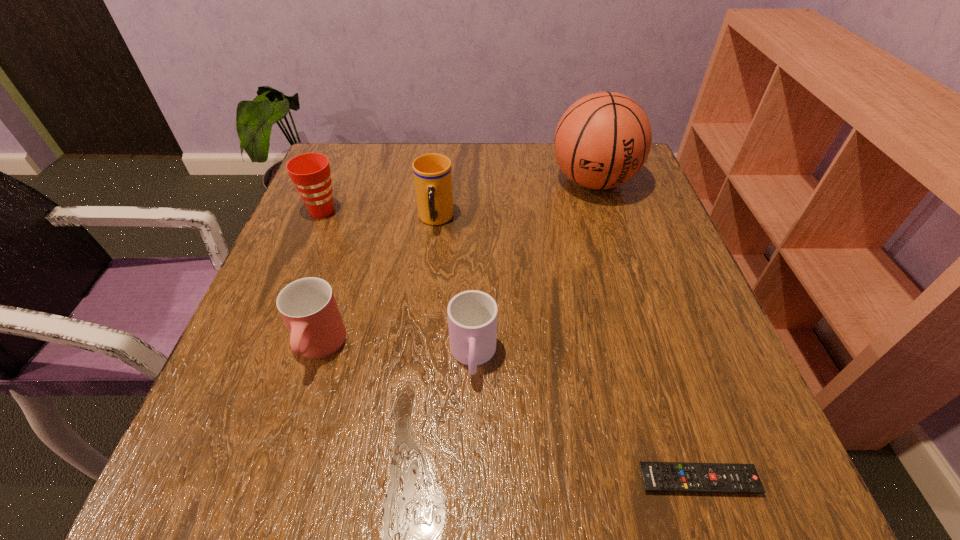
Locate an element on the screen. This screenshot has height=540, width=960. free spot between the third cup from left to right and the leftmost cup is located at coordinates (379, 215).

You are a GUI agent. You are given a task and a screenshot of the screen. Output one action in this format:
    pyautogui.click(x=<x>, y=<y>)
    Task: Click on the empty location between the second cup from left to right and the tallest object
    Image resolution: width=960 pixels, height=540 pixels.
    Given the screenshot: What is the action you would take?
    pyautogui.click(x=456, y=265)

This screenshot has height=540, width=960. I want to click on empty space that is in between the leftmost object and the rightmost cup, so click(x=397, y=284).

Locate an element on the screen. This screenshot has width=960, height=540. vacant area that lies between the second cup from left to right and the basketball is located at coordinates (456, 265).

Find the location of a particular element. This screenshot has width=960, height=540. vacant area between the leftmost object and the shortest object is located at coordinates point(511,346).

Locate an element on the screen. free space that is in between the third object from left to right and the remote control is located at coordinates 567,350.

In order to click on empty space that is in between the third object from right to left and the basketball in this screenshot , I will do `click(533, 269)`.

Find the location of a particular element. This screenshot has height=540, width=960. the third closest object to the fourth object from left to right is located at coordinates (432, 172).

Locate an element on the screen. Image resolution: width=960 pixels, height=540 pixels. object that stands as the fifth closest to the fourth object from left to right is located at coordinates (310, 172).

Select which cup is the closest to the rightmost cup. Please provide its 2D coordinates. Your answer should be formatted as a tuple, i.e. [(x, y)], where the tuple contains the x and y coordinates of a point satisfying the conditions above.

[(308, 307)]